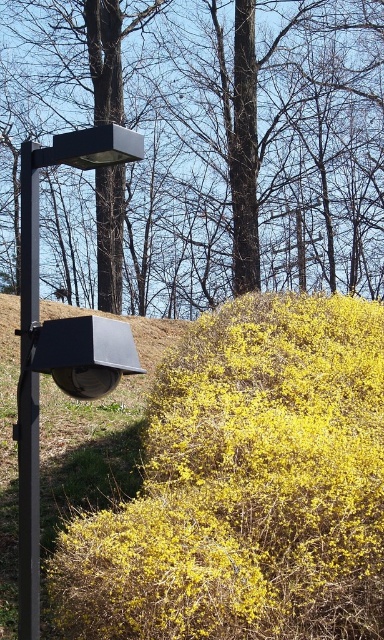
Can you confirm if brown wood tree at upper center is smaller than black metal pole at left?

Yes.

Is point (263, 216) closer to camera compared to point (34, 604)?

No, it is behind (34, 604).

Image resolution: width=384 pixels, height=640 pixels. I want to click on brown wood tree at upper center, so click(x=205, y=147).

Consider the image. Who is lower down, metallic black street sign at left or black metal pole at left?

metallic black street sign at left is below.

Between point (64, 154) and point (26, 554), which one is positioned in front?

Point (26, 554) is in front.

Which is behind, point (49, 371) or point (24, 584)?

The point (24, 584) is more distant.

Locate an element on the screen. This screenshot has width=384, height=640. metallic black street sign at left is located at coordinates (57, 337).

The height and width of the screenshot is (640, 384). What do you see at coordinates (246, 486) in the screenshot? I see `yellow matte bush at center` at bounding box center [246, 486].

Does yellow matte bush at center appear under metallic black street sign at left?

Yes.

Image resolution: width=384 pixels, height=640 pixels. I want to click on yellow matte bush at center, so click(246, 486).

Where is `yellow matte bush at center`? yellow matte bush at center is located at coordinates (246, 486).